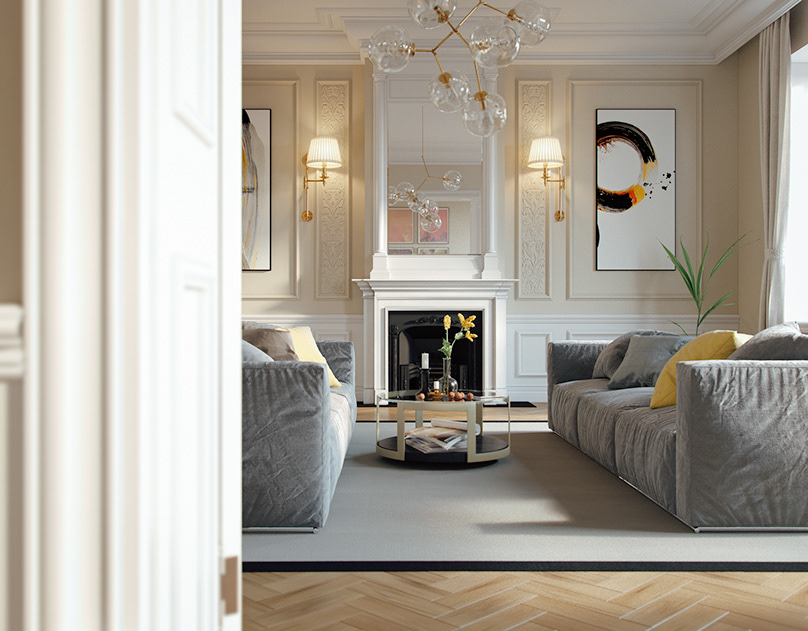
In order to click on rug in this screenshot , I will do `click(402, 534)`.